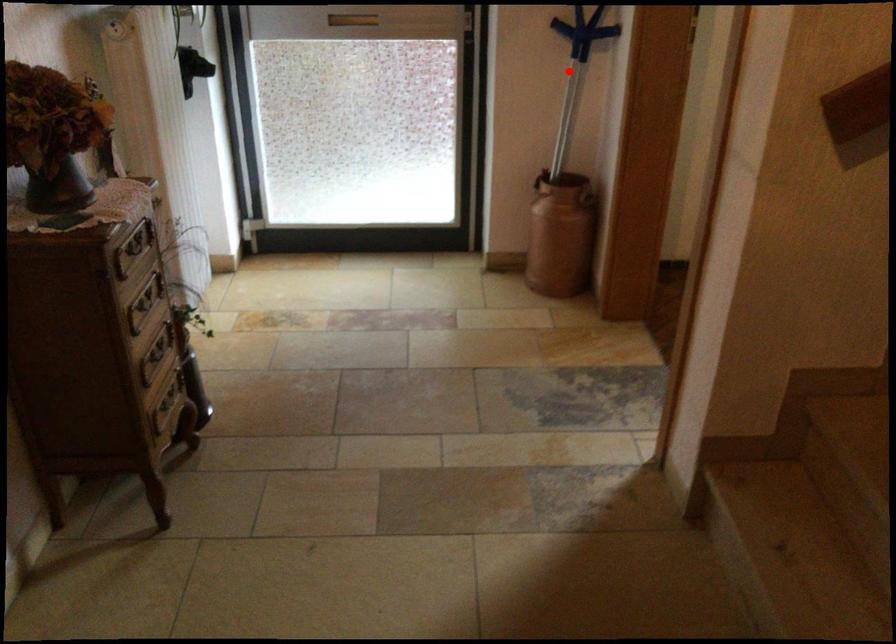
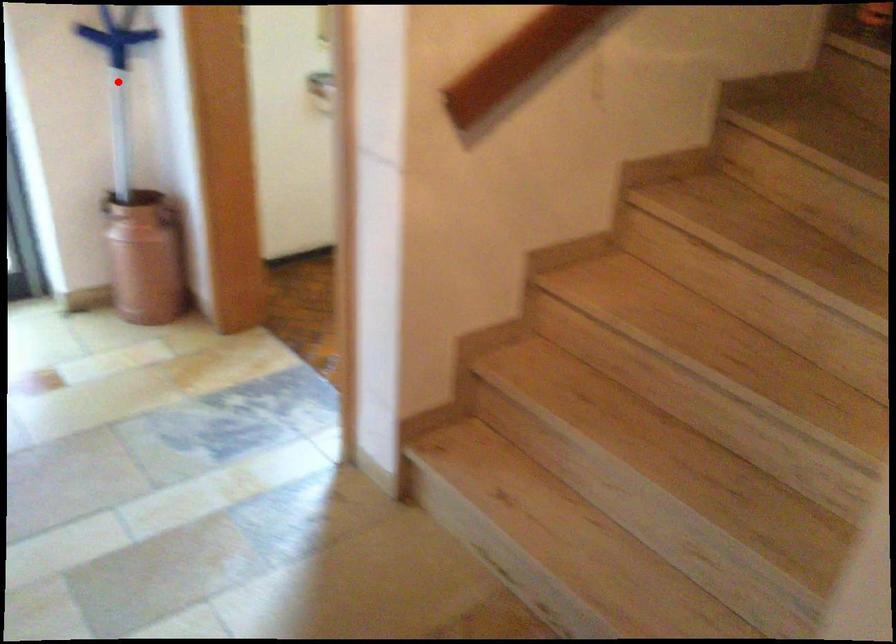
I am providing you with two images of the same scene from different viewpoints. A red point is marked on the first image and another point is marked on the second image. Is the red point in image1 aligned with the point shown in image2?

Yes